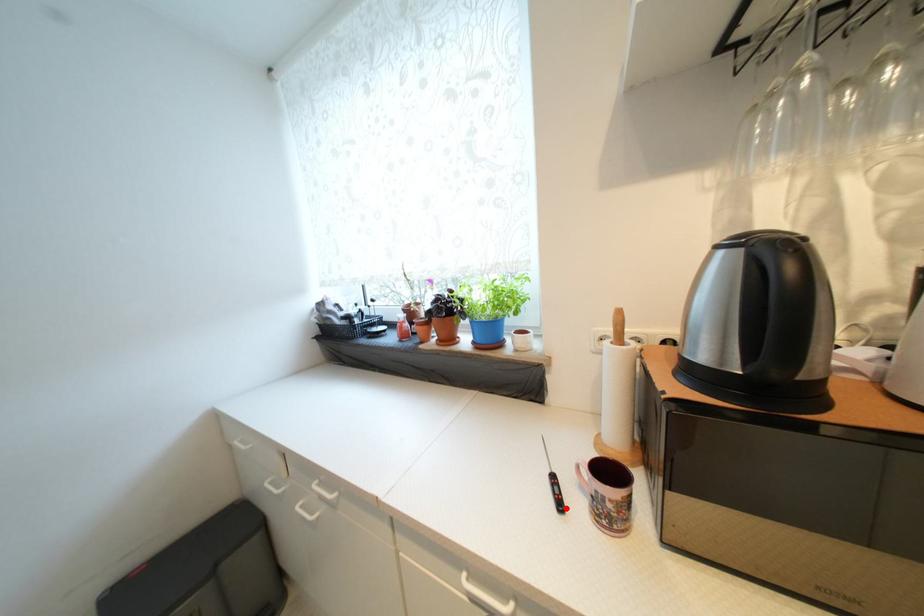
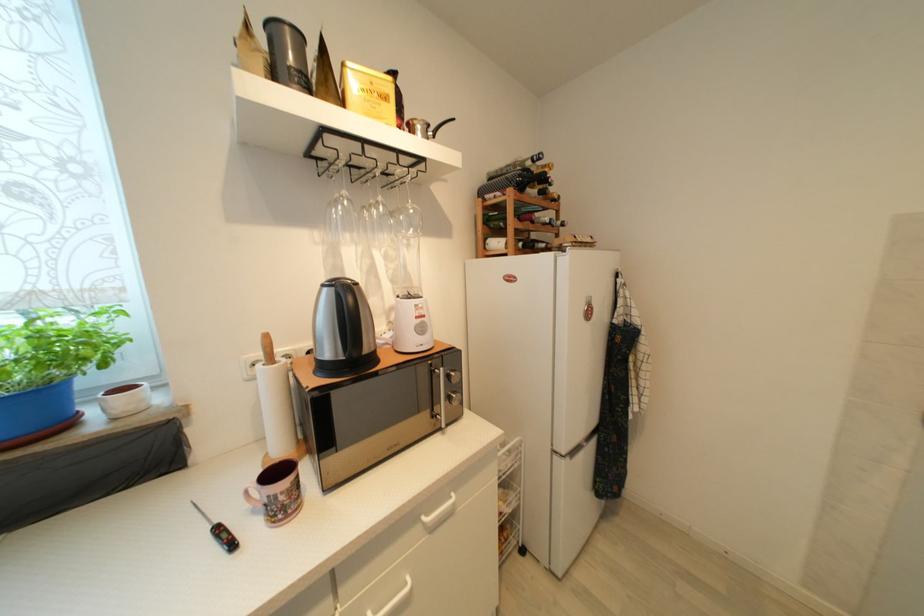
In the second image, find the point that corresponds to the highlighted location in the first image.

(237, 546)